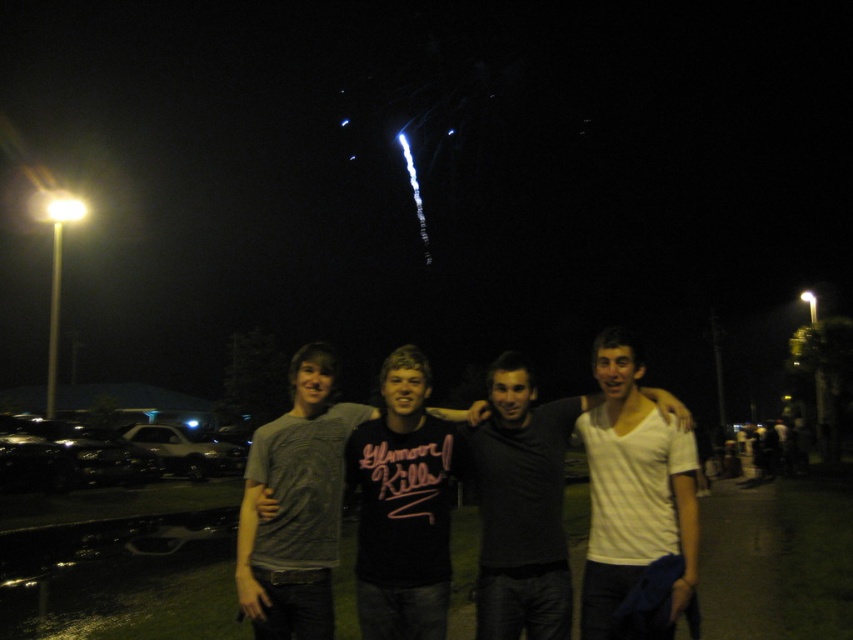
You are a photographer trying to capture the white matte shirt at center in the nighttime scene. Since the scene is lit by street lamps, where should you position your camera relative to the point at point coordinates (520,502) to ensure proper lighting?

The white matte shirt at center is located at point coordinates (520,502), so positioning the camera directly facing this point will ensure the shirt is well lit by the street lamps.